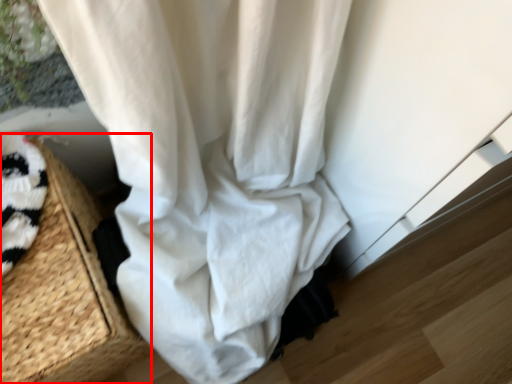
Question: From the image's perspective, where is basket (annotated by the red box) located relative to curtain?

Choices:
 (A) below
 (B) above

Answer: (A)